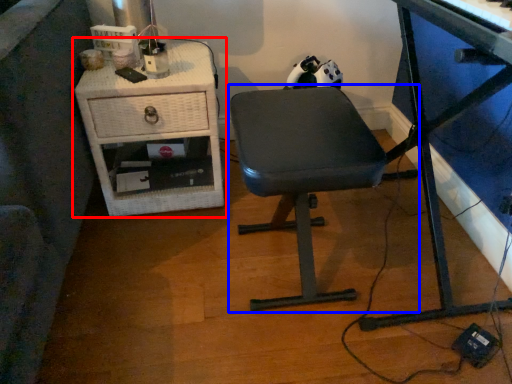
Question: Which of the following is the closest to the observer, nightstand (highlighted by a red box) or chair (highlighted by a blue box)?

Choices:
 (A) nightstand
 (B) chair

Answer: (B)